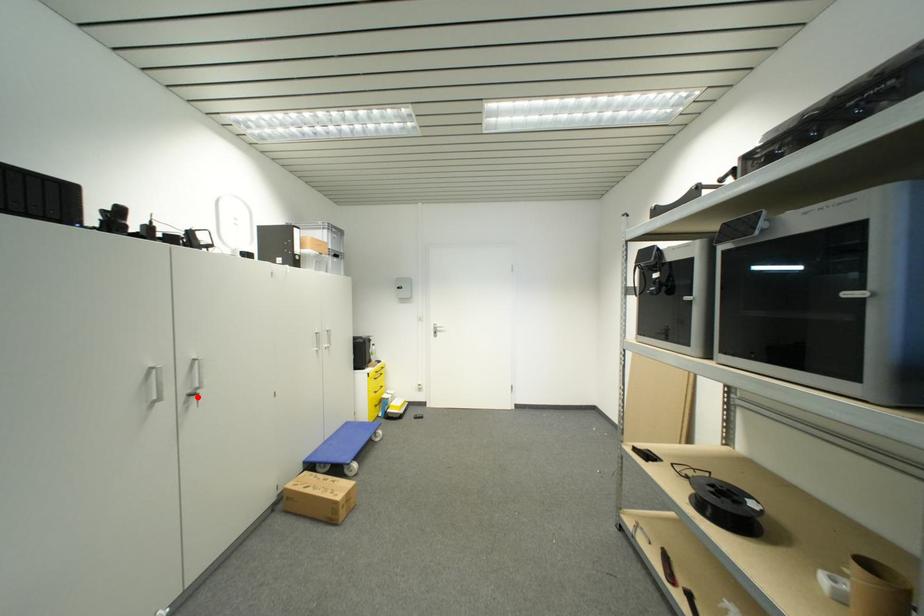
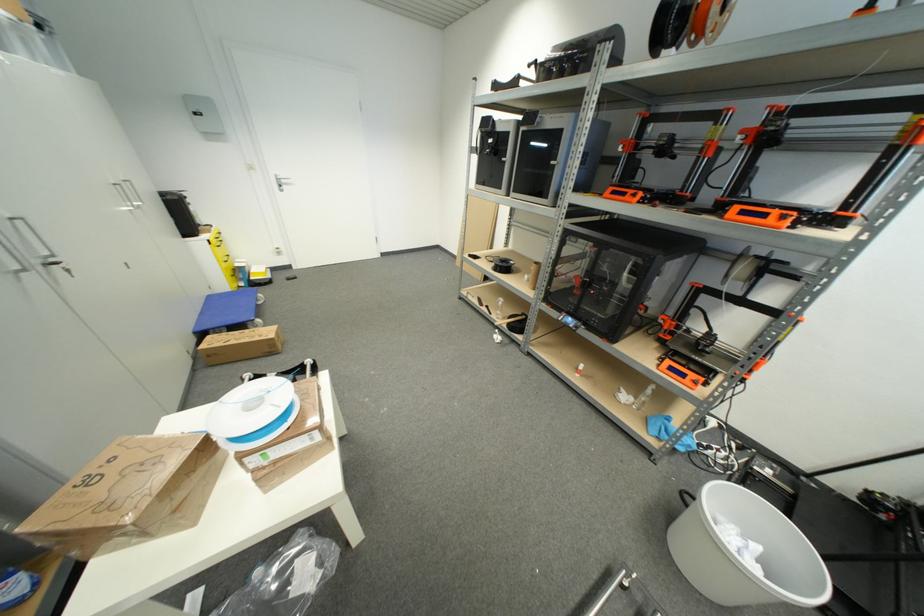
Question: I am providing you with two images of the same scene from different viewpoints. In image1, a red point is highlighted. Considering the same 3D point in image2, which of the following is correct?

Choices:
 (A) It is closer
 (B) It is farther

Answer: (B)